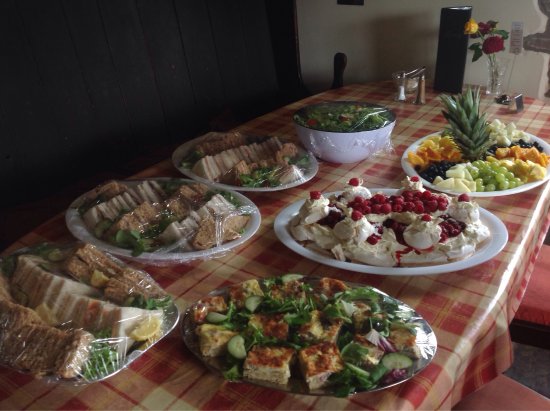
Locate an element on the screen. The height and width of the screenshot is (411, 550). chair cushions is located at coordinates (531, 282), (488, 391).